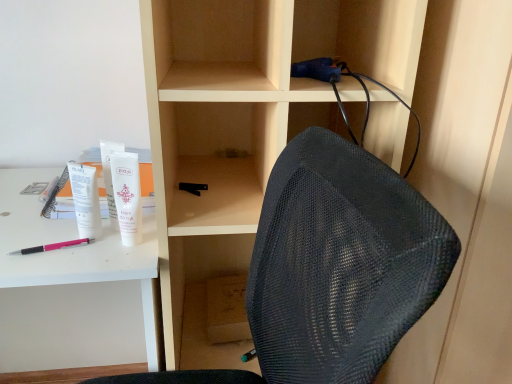
Image resolution: width=512 pixels, height=384 pixels. Find the location of `spots to the right of pink plastic pen at lower left`. spots to the right of pink plastic pen at lower left is located at coordinates (109, 249).